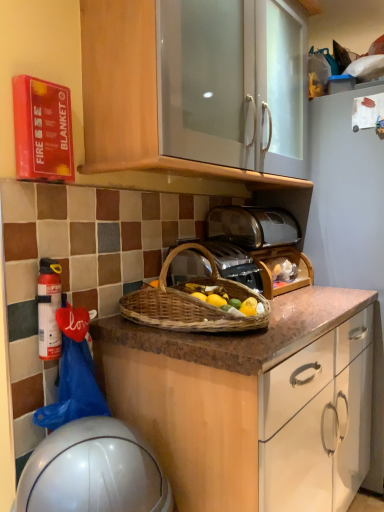
Question: Are white glossy helmet at lower left and woven brown picnic basket at center located far from each other?

Choices:
 (A) no
 (B) yes

Answer: (A)

Question: Considering the relative positions of white glossy helmet at lower left and woven brown picnic basket at center in the image provided, is white glossy helmet at lower left to the left of woven brown picnic basket at center from the viewer's perspective?

Choices:
 (A) no
 (B) yes

Answer: (B)

Question: Does white glossy helmet at lower left appear on the right side of woven brown picnic basket at center?

Choices:
 (A) no
 (B) yes

Answer: (A)

Question: From the image's perspective, would you say white glossy helmet at lower left is positioned over woven brown picnic basket at center?

Choices:
 (A) no
 (B) yes

Answer: (A)

Question: Are white glossy helmet at lower left and woven brown picnic basket at center making contact?

Choices:
 (A) yes
 (B) no

Answer: (B)

Question: Visually, is white glossy helmet at lower left positioned to the left or to the right of metallic silver toaster at center?

Choices:
 (A) right
 (B) left

Answer: (B)

Question: Is white glossy helmet at lower left taller or shorter than metallic silver toaster at center?

Choices:
 (A) short
 (B) tall

Answer: (B)

Question: Is white glossy helmet at lower left spatially inside metallic silver toaster at center, or outside of it?

Choices:
 (A) inside
 (B) outside

Answer: (B)

Question: Relative to metallic silver toaster at center, is white glossy helmet at lower left in front or behind?

Choices:
 (A) behind
 (B) front

Answer: (B)

Question: Is point (251, 175) positioned closer to the camera than point (203, 247)?

Choices:
 (A) farther
 (B) closer

Answer: (A)

Question: In the image, is matte wood cabinet at upper center positioned in front of or behind woven brown picnic basket at center?

Choices:
 (A) front
 (B) behind

Answer: (A)

Question: In terms of height, does matte wood cabinet at upper center look taller or shorter compared to woven brown picnic basket at center?

Choices:
 (A) short
 (B) tall

Answer: (B)

Question: From a real-world perspective, is matte wood cabinet at upper center above or below woven brown picnic basket at center?

Choices:
 (A) below
 (B) above

Answer: (B)

Question: Would you say matte wood cabinet at upper center is inside or outside satin silver toaster at center?

Choices:
 (A) inside
 (B) outside

Answer: (B)

Question: Is point (152, 2) closer or farther from the camera than point (231, 206)?

Choices:
 (A) farther
 (B) closer

Answer: (B)